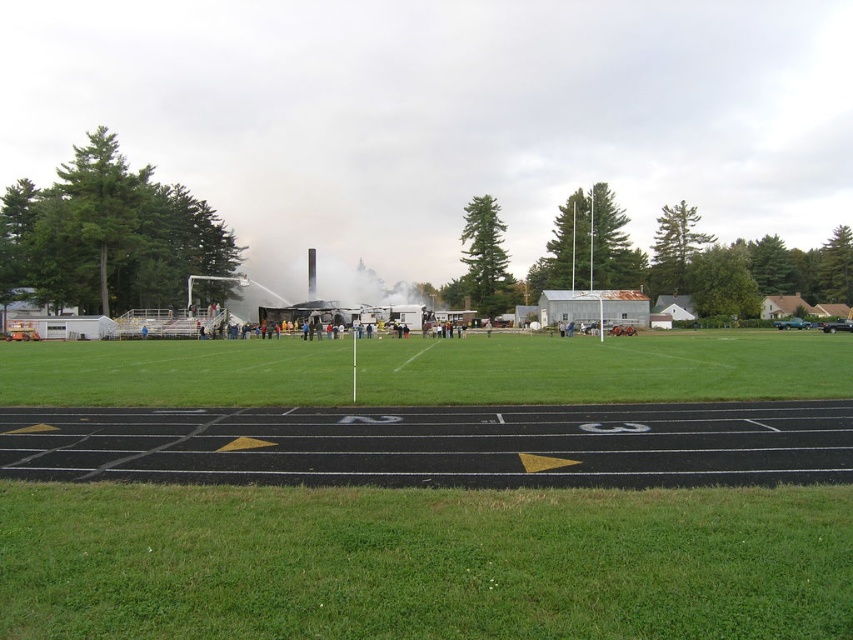
Is green grass at center thinner than white smoke at center?

In fact, green grass at center might be wider than white smoke at center.

Can you confirm if green grass at center is shorter than white smoke at center?

Yes.

Is point (763, 342) positioned after point (260, 273)?

That is False.

Where is `green grass at center`? The height and width of the screenshot is (640, 853). green grass at center is located at coordinates (604, 369).

Locate an element on the screen. This screenshot has width=853, height=640. black asphalt race track at lower center is located at coordinates (437, 444).

From the picture: Does black asphalt race track at lower center have a lesser width compared to white smoke at center?

Correct, black asphalt race track at lower center's width is less than white smoke at center's.

You are a GUI agent. You are given a task and a screenshot of the screen. Output one action in this format:
    pyautogui.click(x=<x>, y=<y>)
    Task: Click on the black asphalt race track at lower center
    This screenshot has width=853, height=640.
    Given the screenshot: What is the action you would take?
    pyautogui.click(x=437, y=444)

Locate an element on the screen. black asphalt race track at lower center is located at coordinates (437, 444).

Does black asphalt race track at lower center have a greater width compared to green grass at center?

No.

Between black asphalt race track at lower center and green grass at center, which one appears on the left side from the viewer's perspective?

Positioned to the left is black asphalt race track at lower center.

What do you see at coordinates (437, 444) in the screenshot? This screenshot has width=853, height=640. I see `black asphalt race track at lower center` at bounding box center [437, 444].

This screenshot has height=640, width=853. In order to click on black asphalt race track at lower center in this screenshot , I will do `click(437, 444)`.